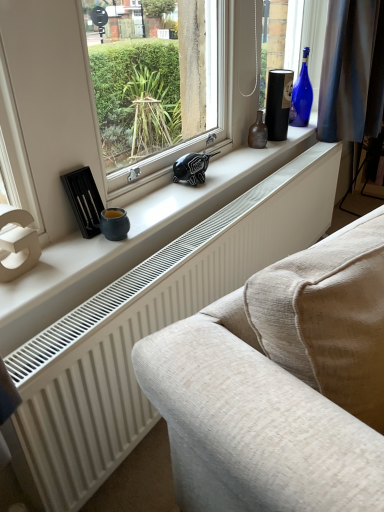
Question: Is the depth of white matte window sill at center greater than that of blue glass bottle at upper right, the 1th bottle in the back-to-front sequence?

Choices:
 (A) no
 (B) yes

Answer: (A)

Question: From the image's perspective, is white matte window sill at center above blue glass bottle at upper right, the 2th bottle from the left?

Choices:
 (A) no
 (B) yes

Answer: (A)

Question: Is white matte window sill at center not near blue glass bottle at upper right, the 2th bottle from the left?

Choices:
 (A) no
 (B) yes

Answer: (A)

Question: Is white matte window sill at center wider than blue glass bottle at upper right, positioned as the first bottle in top-to-bottom order?

Choices:
 (A) yes
 (B) no

Answer: (A)

Question: Can blue glass bottle at upper right, the 1th bottle in the back-to-front sequence, be found inside white matte window sill at center?

Choices:
 (A) yes
 (B) no

Answer: (B)

Question: Does white matte window sill at center appear on the right side of blue glass bottle at upper right, which appears as the 2th bottle when ordered from the bottom?

Choices:
 (A) no
 (B) yes

Answer: (A)

Question: Is blue glass bottle at upper right, the 1th bottle in the back-to-front sequence, far from white textured radiator at lower center?

Choices:
 (A) yes
 (B) no

Answer: (B)

Question: Is blue glass bottle at upper right, which appears as the 2th bottle when ordered from the bottom, placed right next to white textured radiator at lower center?

Choices:
 (A) yes
 (B) no

Answer: (B)

Question: Can you confirm if blue glass bottle at upper right, positioned as the first bottle in top-to-bottom order, is bigger than white textured radiator at lower center?

Choices:
 (A) no
 (B) yes

Answer: (A)

Question: Is blue glass bottle at upper right, which ranks as the 1th bottle in right-to-left order, thinner than white textured radiator at lower center?

Choices:
 (A) yes
 (B) no

Answer: (B)

Question: From a real-world perspective, is blue glass bottle at upper right, the 2th bottle from the left, located beneath white textured radiator at lower center?

Choices:
 (A) yes
 (B) no

Answer: (B)

Question: Is blue glass bottle at upper right, the 2th bottle from the left, aimed at white textured radiator at lower center?

Choices:
 (A) no
 (B) yes

Answer: (A)

Question: From the image's perspective, would you say blue glass bottle at upper right, the 2th bottle in the front-to-back sequence, is positioned over brown glass bottle at center, the 1th bottle in the left-to-right sequence?

Choices:
 (A) no
 (B) yes

Answer: (B)